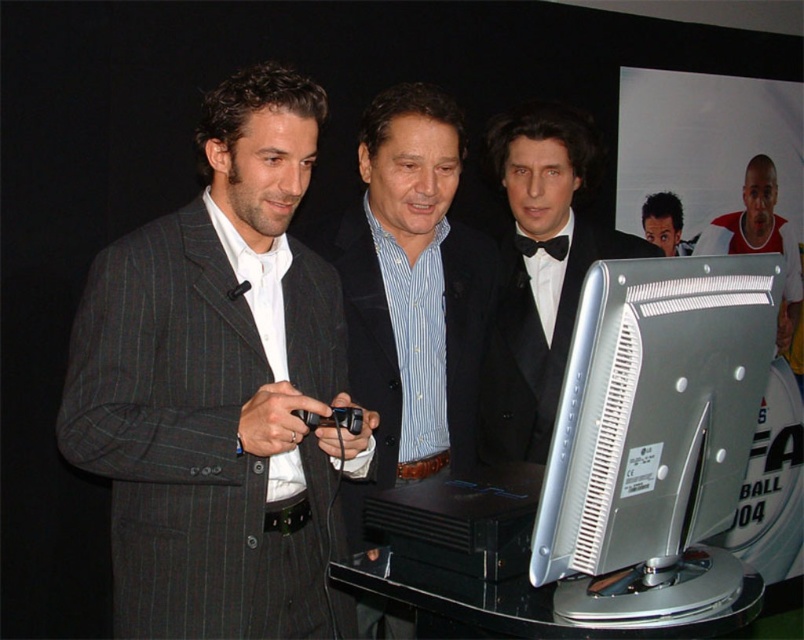
This screenshot has height=640, width=804. What do you see at coordinates (220, 388) in the screenshot? I see `gray pinstripe suit at left` at bounding box center [220, 388].

Can you confirm if gray pinstripe suit at left is shorter than blue striped shirt at center?

Indeed, gray pinstripe suit at left has a lesser height compared to blue striped shirt at center.

This screenshot has width=804, height=640. Describe the element at coordinates (220, 388) in the screenshot. I see `gray pinstripe suit at left` at that location.

Image resolution: width=804 pixels, height=640 pixels. What are the coordinates of `gray pinstripe suit at left` in the screenshot? It's located at (220, 388).

Is point (458, 440) closer to camera compared to point (556, 275)?

Yes, point (458, 440) is closer to viewer.

Identify the location of blue striped shirt at center. (409, 291).

Identify the location of blue striped shirt at center. The width and height of the screenshot is (804, 640). (409, 291).

From the picture: Does silver metallic computer monitor at right have a greater width compared to blue striped shirt at center?

No, silver metallic computer monitor at right is not wider than blue striped shirt at center.

Between silver metallic computer monitor at right and blue striped shirt at center, which one appears on the left side from the viewer's perspective?

blue striped shirt at center

Identify the location of silver metallic computer monitor at right. The image size is (804, 640). (654, 436).

Where is `silver metallic computer monitor at right`? silver metallic computer monitor at right is located at coordinates (654, 436).